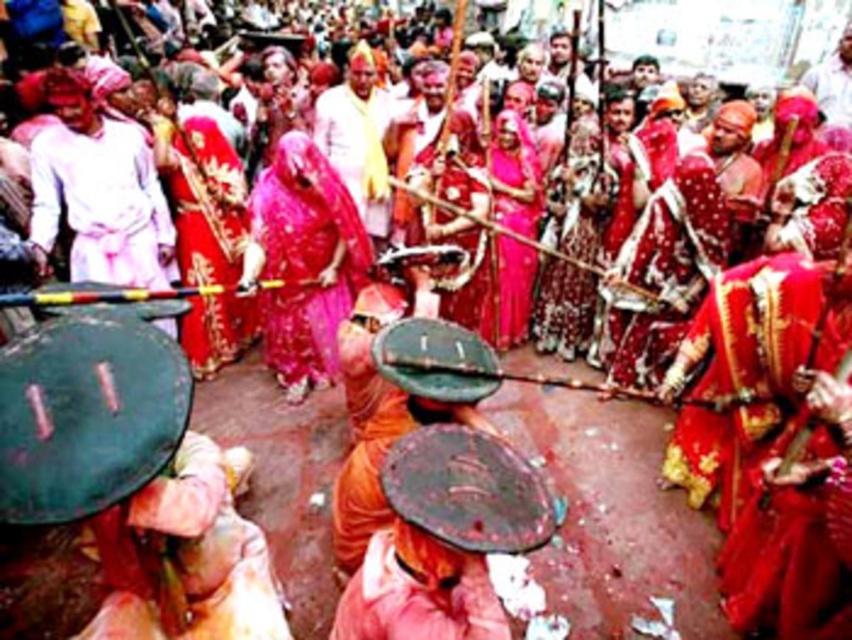
In the festival scene, there is a point marked at coordinates (304,259). What object is located at that point?

The point at coordinates (304,259) indicates the location of the matte pink sari at center.

You are a photographer wanting to capture both the white matte robe at left and the matte yellow cloth at center in a single frame. Considering their sizes, which object should you focus on to ensure both fit in the photo without cropping?

Since the white matte robe at left is wider than the matte yellow cloth at center, you should focus on the white matte robe at left as it occupies more space, ensuring both objects are included in the frame.

You are standing in the festival crowd and want to reach a point closer to you. Which of the two points, point (349,280) or point (225,166), should you head towards?

Point (349,280) is closer to the viewer, so you should head towards point (349,280).